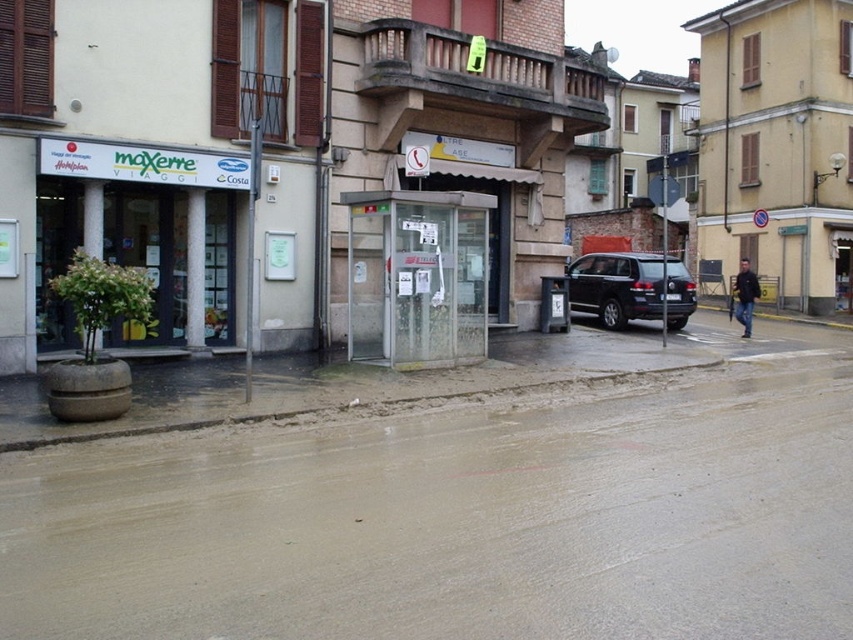
Question: Can you confirm if transparent glass booth at center is positioned to the right of white glossy signboard at upper left?

Choices:
 (A) no
 (B) yes

Answer: (B)

Question: Can you confirm if white glossy signboard at upper left is thinner than black matte suv at center?

Choices:
 (A) no
 (B) yes

Answer: (B)

Question: Which object appears closest to the camera in this image?

Choices:
 (A) black matte suv at center
 (B) dark blue jacket at lower right
 (C) transparent glass booth at center

Answer: (C)

Question: Among these points, which one is nearest to the camera?

Choices:
 (A) (456, 321)
 (B) (630, 268)
 (C) (152, 182)

Answer: (C)

Question: Is black matte suv at center below dark blue jacket at lower right?

Choices:
 (A) yes
 (B) no

Answer: (B)

Question: Among these points, which one is farthest from the camera?

Choices:
 (A) (350, 278)
 (B) (96, 172)
 (C) (737, 308)
 (D) (589, 257)

Answer: (D)